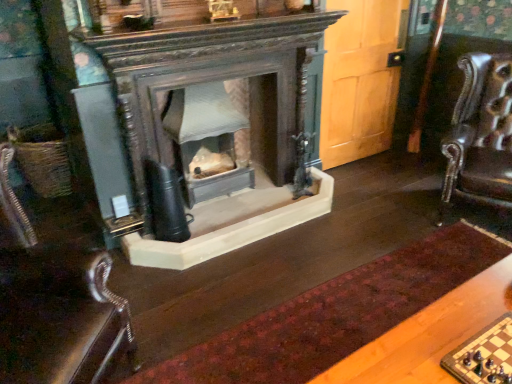
The width and height of the screenshot is (512, 384). I want to click on vacant space underneath leather swivel chair at right (from a real-world perspective), so click(466, 220).